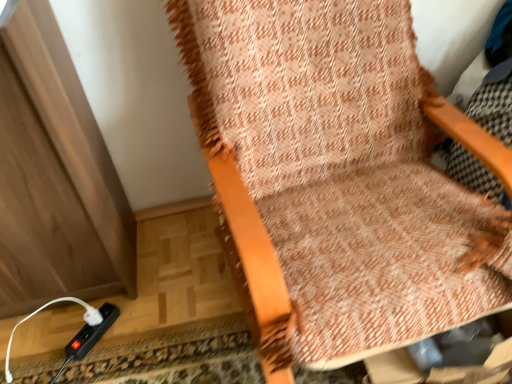
What do you see at coordinates (339, 176) in the screenshot? The width and height of the screenshot is (512, 384). I see `wooden chair at upper right` at bounding box center [339, 176].

Where is `wooden chair at upper right`? wooden chair at upper right is located at coordinates (339, 176).

Identify the location of wooden chair at upper right. This screenshot has width=512, height=384. (339, 176).